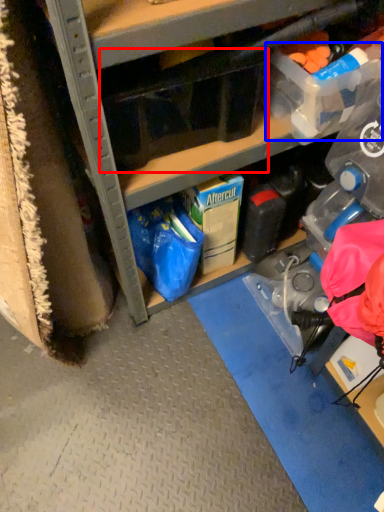
Question: Which point is further to the camera, storage box (highlighted by a red box) or storage box (highlighted by a blue box)?

Choices:
 (A) storage box
 (B) storage box

Answer: (B)